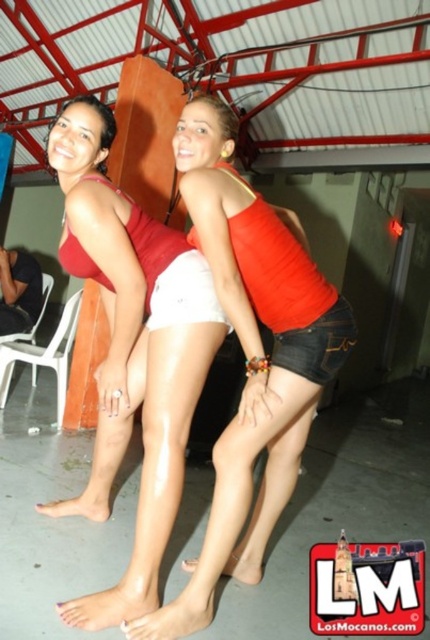
Does matte red tank top at center appear over white denim shorts at center?

Indeed, matte red tank top at center is positioned over white denim shorts at center.

Does matte red tank top at center have a lesser height compared to white denim shorts at center?

Yes.

Which is behind, point (181, 257) or point (227, 547)?

Positioned behind is point (181, 257).

Find the location of a particular element. This screenshot has width=430, height=640. matte red tank top at center is located at coordinates (132, 353).

Is white denim shorts at center below white fabric shorts at center?

Indeed, white denim shorts at center is positioned under white fabric shorts at center.

Between white denim shorts at center and white fabric shorts at center, which one appears on the right side from the viewer's perspective?

white denim shorts at center

Which is in front, point (249, 349) or point (196, 256)?

Point (249, 349) is more forward.

I want to click on white denim shorts at center, so click(x=248, y=356).

Looking at this image, who is positioned more to the right, matte red tank top at center or white fabric shorts at center?

white fabric shorts at center

Locate an element on the screen. Image resolution: width=430 pixels, height=640 pixels. matte red tank top at center is located at coordinates (132, 353).